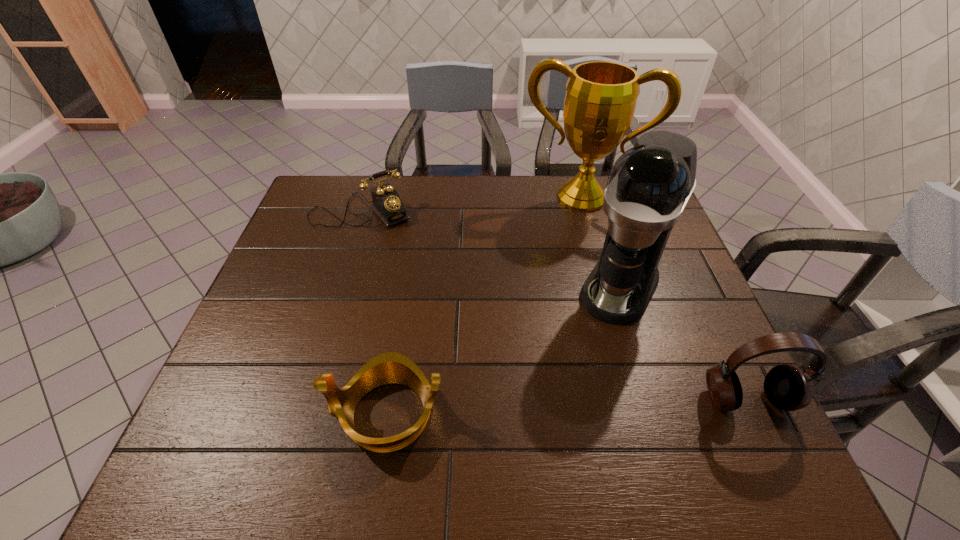
Where is `free space on the desktop that is between the tiara and the headset and is positioned place cup under the spout of the third nearest object`? free space on the desktop that is between the tiara and the headset and is positioned place cup under the spout of the third nearest object is located at coordinates (551, 407).

You are a GUI agent. You are given a task and a screenshot of the screen. Output one action in this format:
    pyautogui.click(x=<x>, y=<y>)
    Task: Click on the vacant space on the desktop that is between the tiara and the third tallest object and is positioned on the dial of the telephone
    
    Given the screenshot: What is the action you would take?
    tap(516, 408)

Locate an element on the screen. The width and height of the screenshot is (960, 540). vacant space on the desktop that is between the tiara and the headset and is positioned on the front-facing side of the award is located at coordinates (542, 407).